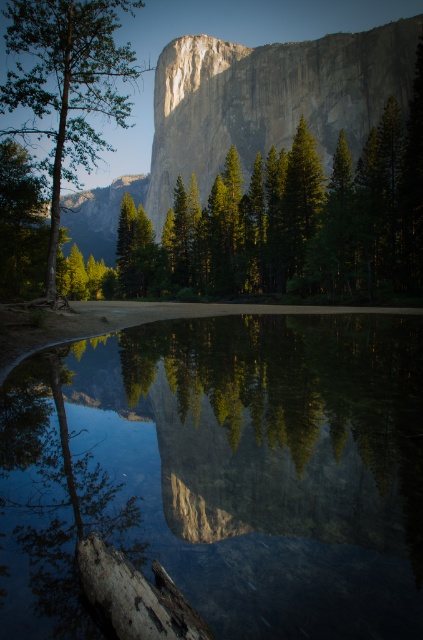
Looking at this image, does green matte tree at left have a larger size compared to dark brown wood log at lower left?

Correct, green matte tree at left is larger in size than dark brown wood log at lower left.

Between green matte tree at left and dark brown wood log at lower left, which one has less height?

dark brown wood log at lower left is shorter.

Between point (57, 84) and point (147, 612), which one is positioned in front?

Positioned in front is point (147, 612).

Locate an element on the screen. The height and width of the screenshot is (640, 423). green matte tree at left is located at coordinates (68, 83).

Is transparent glass water at center above dark brown wood log at lower left?

Yes, transparent glass water at center is above dark brown wood log at lower left.

Is point (233, 506) positioned in front of point (107, 584)?

That is False.

Between point (302, 509) and point (114, 554), which one is positioned in front?

Positioned in front is point (114, 554).

Find the location of a particular element. The image size is (423, 640). transparent glass water at center is located at coordinates (222, 474).

Which of these two, granite cliff at center or green matte tree at left, stands taller?

green matte tree at left

Is granite cliff at center closer to the viewer compared to green matte tree at left?

No, granite cliff at center is further to the viewer.

Which is in front, point (189, 140) or point (74, 147)?

Point (74, 147) is more forward.

Identify the location of granite cliff at center. (269, 99).